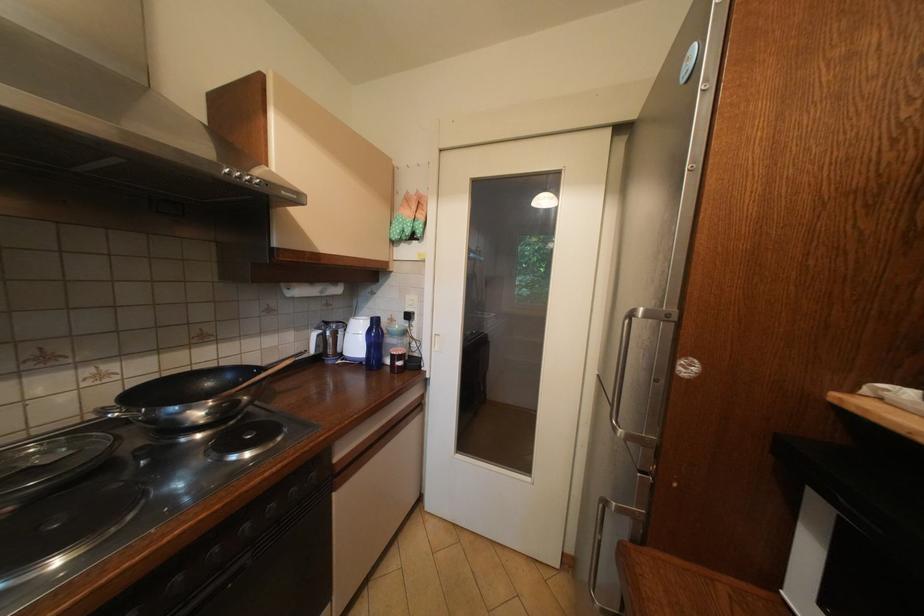
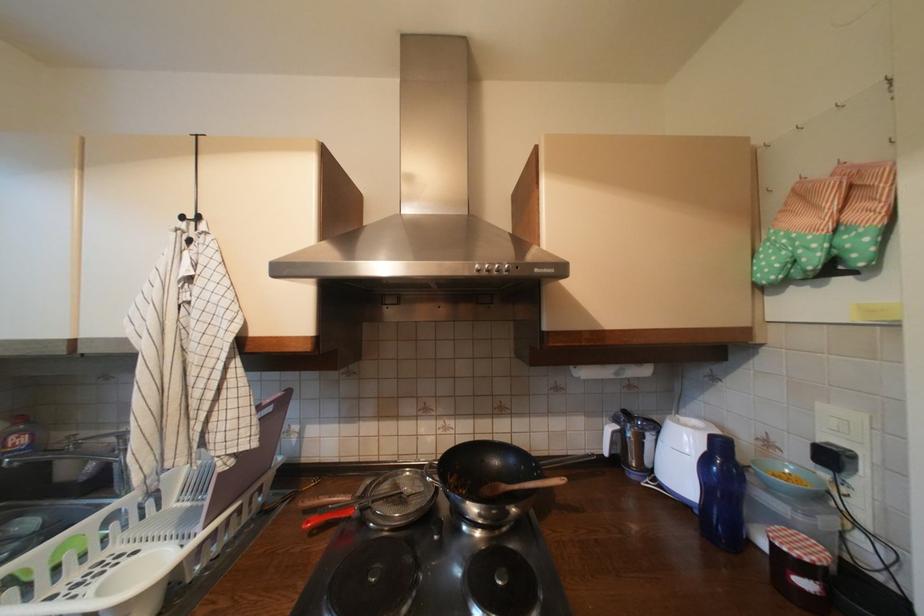
Find the pixel in the second image that matches point 252,386 in the first image.

(525, 488)